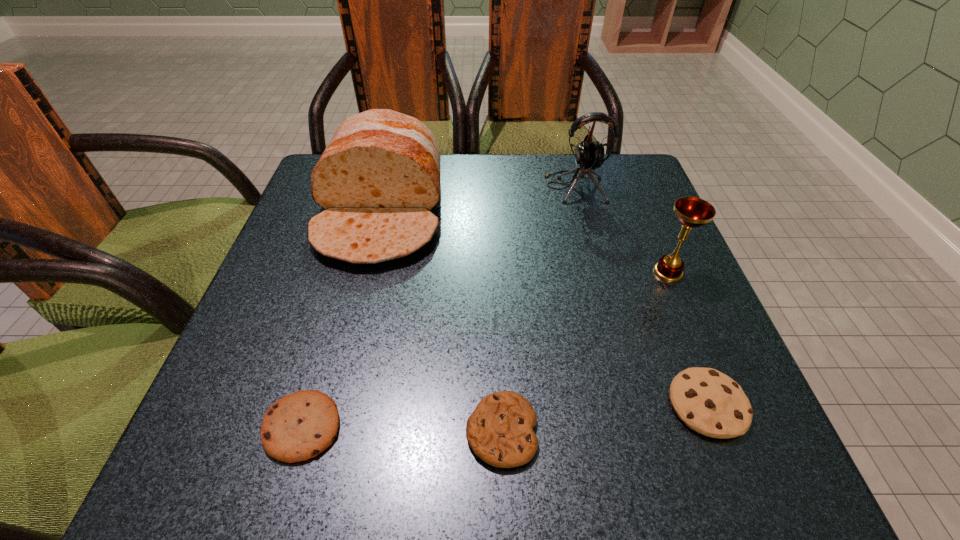
The width and height of the screenshot is (960, 540). I want to click on free space between the fourth object from right to left and the tallest cookie, so click(x=605, y=418).

Find the location of a particular element. object that is the third closest to the bread is located at coordinates (500, 432).

Identify which object is the third nearest to the earphone. Please provide its 2D coordinates. Your answer should be formatted as a tuple, i.e. [(x, y)], where the tuple contains the x and y coordinates of a point satisfying the conditions above.

[(709, 402)]

The width and height of the screenshot is (960, 540). I want to click on cookie that is the closest to the bread, so click(297, 427).

Identify which cookie is the second nearest to the earphone. Please provide its 2D coordinates. Your answer should be formatted as a tuple, i.e. [(x, y)], where the tuple contains the x and y coordinates of a point satisfying the conditions above.

[(500, 432)]

Locate an element on the screen. This screenshot has height=540, width=960. vacant space that satisfies the following two spatial constraints: 1. at the sliced end of the second cookie from right to left; 2. on the right side of the bread is located at coordinates (325, 431).

This screenshot has height=540, width=960. I want to click on vacant area that satisfies the following two spatial constraints: 1. at the sliced end of the second cookie from left to right; 2. on the left side of the bread, so click(325, 431).

You are a GUI agent. You are given a task and a screenshot of the screen. Output one action in this format:
    pyautogui.click(x=<x>, y=<y>)
    Task: Click on the vacant space that satisfies the following two spatial constraints: 1. at the sliced end of the tallest cookie; 2. on the right side of the bread
    The height and width of the screenshot is (540, 960).
    Given the screenshot: What is the action you would take?
    pyautogui.click(x=332, y=404)